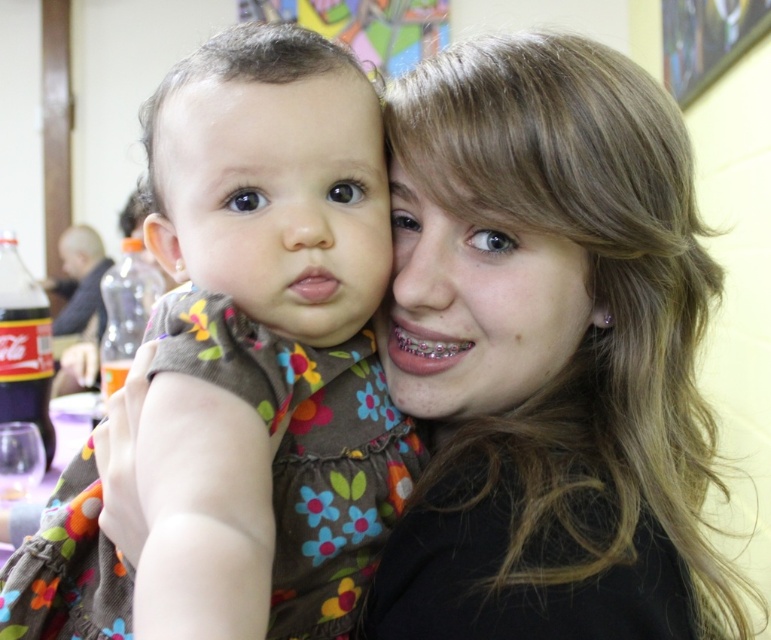
Question: Considering the real-world distances, which object is farthest from the smooth skin face at center?

Choices:
 (A) brown matte baby at center
 (B) floral fabric dress at center
 (C) matte plastic bottle at left
 (D) smooth blonde hair at center

Answer: (C)

Question: Among these points, which one is farthest from the camera?

Choices:
 (A) (15, 250)
 (B) (504, 387)
 (C) (285, 486)

Answer: (A)

Question: Does smooth skin face at center appear under matte plastic bottle at left?

Choices:
 (A) no
 (B) yes

Answer: (B)

Question: Can you confirm if black glass bottle at lower left is bigger than matte plastic bottle at left?

Choices:
 (A) yes
 (B) no

Answer: (B)

Question: Does smooth skin face at center appear under black glass bottle at lower left?

Choices:
 (A) yes
 (B) no

Answer: (B)

Question: Which of the following is the closest to the observer?

Choices:
 (A) (49, 368)
 (B) (530, 228)

Answer: (B)